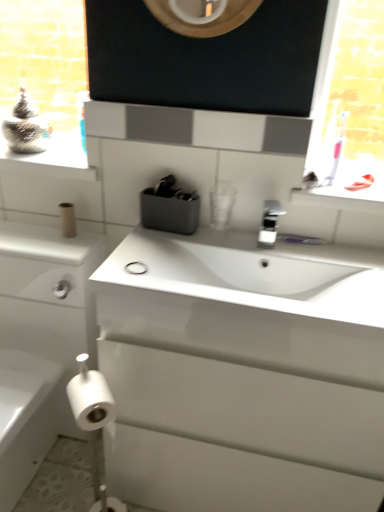
The image size is (384, 512). Find the location of `vacant space that is to the left of brown cardboard toilet paper at lower left, the 3th toilet paper ordered from the bottom`. vacant space that is to the left of brown cardboard toilet paper at lower left, the 3th toilet paper ordered from the bottom is located at coordinates (27, 234).